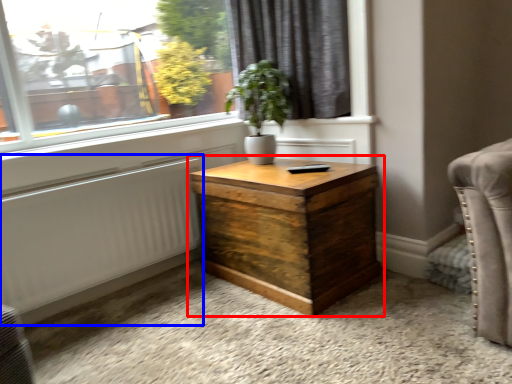
Question: Which object appears farthest to the camera in this image, nightstand (highlighted by a red box) or radiator (highlighted by a blue box)?

Choices:
 (A) nightstand
 (B) radiator

Answer: (B)